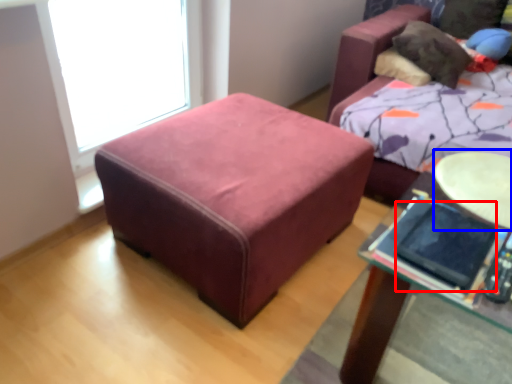
Question: Which object is closer to the camera taking this photo, ipad (highlighted by a red box) or round table (highlighted by a blue box)?

Choices:
 (A) ipad
 (B) round table

Answer: (A)